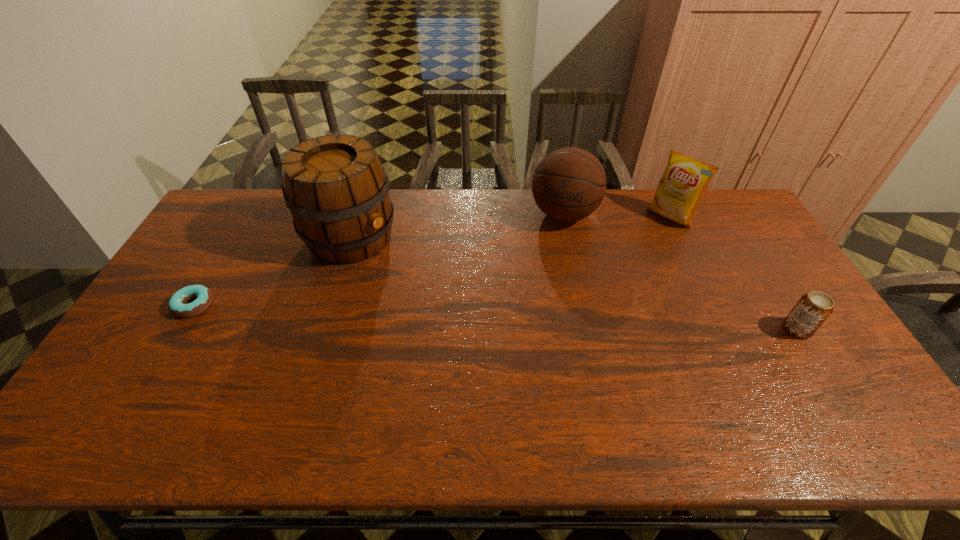
Where is `free space in the image that satisfies the following two spatial constraints: 1. on the front side of the beer can; 2. on the left side of the fourth object from left to right`? free space in the image that satisfies the following two spatial constraints: 1. on the front side of the beer can; 2. on the left side of the fourth object from left to right is located at coordinates (725, 329).

You are a GUI agent. You are given a task and a screenshot of the screen. Output one action in this format:
    pyautogui.click(x=<x>, y=<y>)
    Task: Click on the free location that satisfies the following two spatial constraints: 1. on the back side of the basketball; 2. on the left side of the leftmost object
    
    Given the screenshot: What is the action you would take?
    pyautogui.click(x=248, y=214)